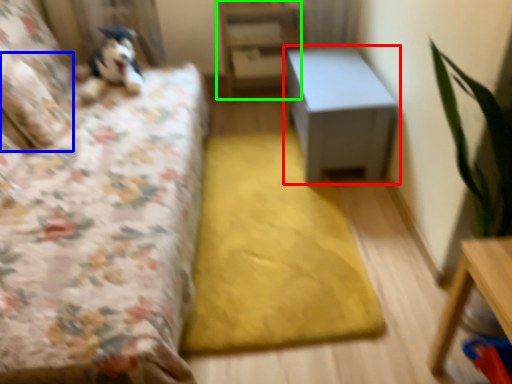
Question: Estimate the real-world distances between objects in this image. Which object is farther from table (highlighted by a red box), pillow (highlighted by a blue box) or bookshelf (highlighted by a green box)?

Choices:
 (A) pillow
 (B) bookshelf

Answer: (A)